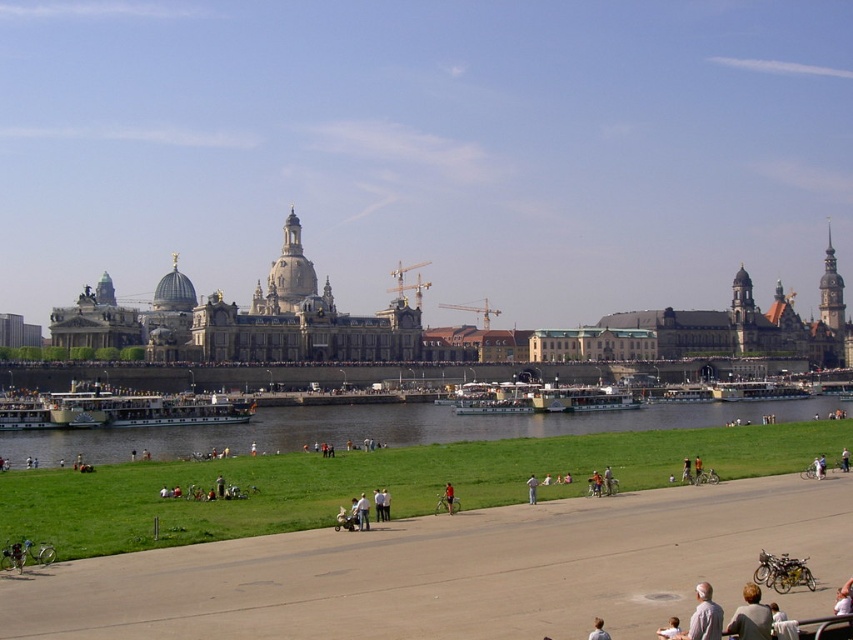
Question: Is blonde hair at lower right to the left of red shirt at center from the viewer's perspective?

Choices:
 (A) no
 (B) yes

Answer: (A)

Question: Which point appears closest to the camera in this image?

Choices:
 (A) (448, 496)
 (B) (529, 497)

Answer: (A)

Question: Which of the following is the closest to the observer?

Choices:
 (A) (683, 460)
 (B) (358, 502)
 (C) (751, 624)
 (D) (453, 493)

Answer: (C)

Question: Which point appears farthest from the camera in this image?

Choices:
 (A) (357, 525)
 (B) (532, 476)
 (C) (689, 476)
 (D) (672, 634)

Answer: (B)

Question: Is light blue jeans at center bigger than white cotton shirt at center?

Choices:
 (A) yes
 (B) no

Answer: (A)

Question: Does blonde hair at lower right have a greater width compared to light brown hair at lower right?

Choices:
 (A) yes
 (B) no

Answer: (A)